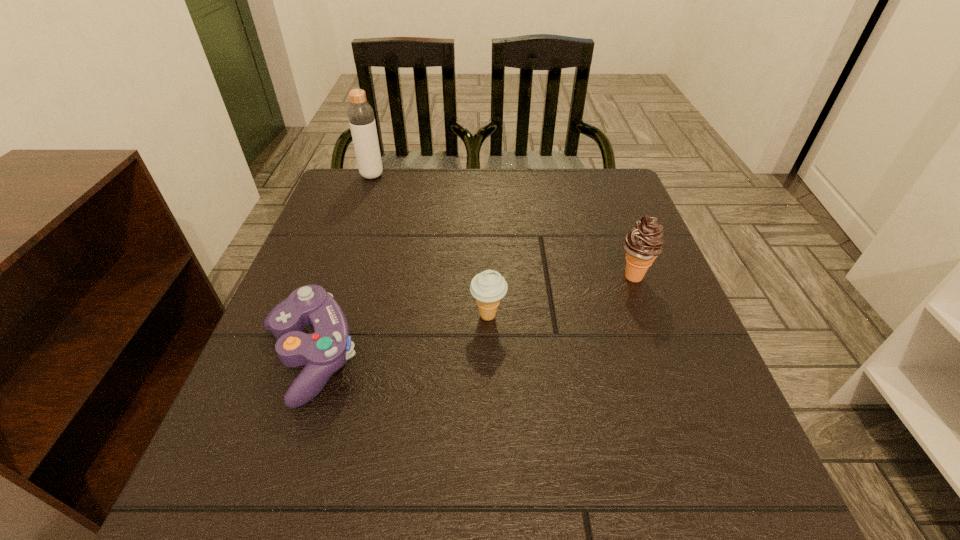
Identify the location of bottle. (361, 117).

What are the coordinates of `the farthest object` in the screenshot? It's located at (361, 117).

At what (x,y) coordinates should I click in order to perform the action: click on the right icecream. Please return your answer as a coordinate pair (x, y). The width and height of the screenshot is (960, 540). Looking at the image, I should click on (643, 243).

This screenshot has height=540, width=960. Identify the location of the taller icecream. (643, 243).

You are a GUI agent. You are given a task and a screenshot of the screen. Output one action in this format:
    pyautogui.click(x=<x>, y=<y>)
    Task: Click on the left icecream
    The width and height of the screenshot is (960, 540).
    Given the screenshot: What is the action you would take?
    pyautogui.click(x=488, y=287)

At what (x,y) coordinates should I click in order to perform the action: click on the nearer icecream. Please return your answer as a coordinate pair (x, y). Image resolution: width=960 pixels, height=540 pixels. Looking at the image, I should click on [488, 287].

You are a GUI agent. You are given a task and a screenshot of the screen. Output one action in this format:
    pyautogui.click(x=<x>, y=<y>)
    Task: Click on the control
    The image size is (960, 540).
    Given the screenshot: What is the action you would take?
    pyautogui.click(x=325, y=351)

This screenshot has height=540, width=960. What are the coordinates of `vacant space located 0.080m on the front of the bottle` in the screenshot? It's located at (364, 197).

You are a GUI agent. You are given a task and a screenshot of the screen. Output one action in this format:
    pyautogui.click(x=<x>, y=<y>)
    Task: Click on the vacant space located on the left of the rightmost object
    
    Given the screenshot: What is the action you would take?
    pyautogui.click(x=469, y=276)

Locate an element on the screen. blank space located on the right of the nearer icecream is located at coordinates (629, 316).